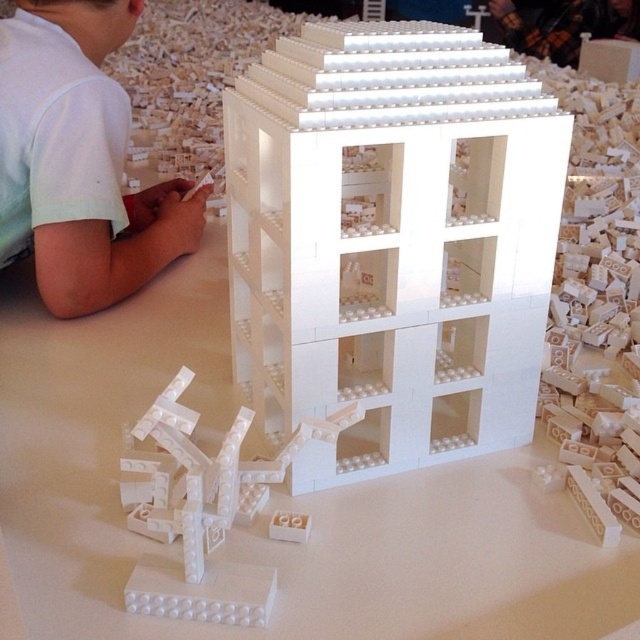
Can you confirm if white plastic building at center is wider than white matte shirt at upper left?

Correct, the width of white plastic building at center exceeds that of white matte shirt at upper left.

Can you confirm if white plastic building at center is positioned above white matte shirt at upper left?

Actually, white plastic building at center is below white matte shirt at upper left.

Which is in front, point (300, 474) or point (125, 225)?

Positioned in front is point (300, 474).

Locate an element on the screen. This screenshot has height=640, width=640. white plastic building at center is located at coordinates (390, 241).